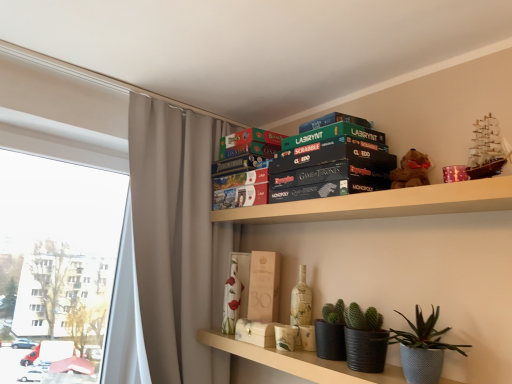
The width and height of the screenshot is (512, 384). What do you see at coordinates (236, 291) in the screenshot?
I see `white textured vase at center, the 1th paperback book in the left-to-right sequence` at bounding box center [236, 291].

Measure the distance between point (251, 307) and camera.

The distance of point (251, 307) from camera is 6.10 feet.

Find the location of a particular element. wooden board game boxes at upper center, placed as the 2th shelf when sorted from bottom to top is located at coordinates (382, 204).

The height and width of the screenshot is (384, 512). What do you see at coordinates (330, 163) in the screenshot? I see `black cardboard game box at upper center` at bounding box center [330, 163].

The height and width of the screenshot is (384, 512). In order to click on transparent glass window at left in this screenshot , I will do `click(59, 262)`.

What are the coordinates of `matte black pots at lower center, the first shelf ordered from the bottom` in the screenshot? It's located at (298, 362).

Looking at this image, is black cardboard game box at upper center not close to gray fabric curtain at upper left?

black cardboard game box at upper center is near gray fabric curtain at upper left, not far away.

In the scene shown: Is black cardboard game box at upper center facing towards gray fabric curtain at upper left?

No, black cardboard game box at upper center is not turned towards gray fabric curtain at upper left.

Between black cardboard game box at upper center and gray fabric curtain at upper left, which one has less height?

Standing shorter between the two is black cardboard game box at upper center.

Is point (335, 127) closer or farther from the camera than point (155, 322)?

Clearly, point (335, 127) is closer to the camera than point (155, 322).

Considering the relative sizes of matte black pots at lower center, which appears as the 2th shelf when viewed from the top, and brown plush bear at upper right in the image provided, is matte black pots at lower center, which appears as the 2th shelf when viewed from the top, shorter than brown plush bear at upper right?

Indeed, matte black pots at lower center, which appears as the 2th shelf when viewed from the top, has a lesser height compared to brown plush bear at upper right.

Between point (442, 380) and point (396, 179), which one is positioned in front?

Positioned in front is point (442, 380).

How different are the orientations of matte black pots at lower center, the first shelf ordered from the bottom, and brown plush bear at upper right in degrees?

The angular difference between matte black pots at lower center, the first shelf ordered from the bottom, and brown plush bear at upper right is 3.18 degrees.

Does matte black pots at lower center, the first shelf ordered from the bottom, have a larger size compared to brown plush bear at upper right?

Yes, matte black pots at lower center, the first shelf ordered from the bottom, is bigger than brown plush bear at upper right.

This screenshot has width=512, height=384. I want to click on houseplant lying on the right of black cardboard game box at upper center, so [x=423, y=348].

Is black cardboard game box at upper center situated inside textured gray pot at lower right or outside?

black cardboard game box at upper center is not enclosed by textured gray pot at lower right.

Consider the image. Which object is thinner, black cardboard game box at upper center or textured gray pot at lower right?

textured gray pot at lower right.

Is black cardboard game box at upper center oriented away from textured gray pot at lower right?

black cardboard game box at upper center is not turned away from textured gray pot at lower right.

Which point is more distant from viewer, (243, 303) or (156, 373)?

The point (243, 303) is farther from the camera.

From the picture: Who is shorter, white textured vase at center, positioned as the third paperback book in top-to-bottom order, or gray fabric curtain at upper left?

With less height is white textured vase at center, positioned as the third paperback book in top-to-bottom order.

Considering the sizes of objects white textured vase at center, the 1th paperback book when ordered from bottom to top, and gray fabric curtain at upper left in the image provided, who is bigger, white textured vase at center, the 1th paperback book when ordered from bottom to top, or gray fabric curtain at upper left?

gray fabric curtain at upper left is bigger.

Is wooden board game boxes at upper center, the first shelf from the top, oriented away from black cardboard game box at upper center?

No, wooden board game boxes at upper center, the first shelf from the top,'s orientation is not away from black cardboard game box at upper center.

Considering the sizes of objects wooden board game boxes at upper center, placed as the 2th shelf when sorted from bottom to top, and black cardboard game box at upper center in the image provided, who is smaller, wooden board game boxes at upper center, placed as the 2th shelf when sorted from bottom to top, or black cardboard game box at upper center?

wooden board game boxes at upper center, placed as the 2th shelf when sorted from bottom to top.

Between wooden board game boxes at upper center, placed as the 2th shelf when sorted from bottom to top, and black cardboard game box at upper center, which one has more height?

With more height is black cardboard game box at upper center.

Which is correct: wooden board game boxes at upper center, the first shelf from the top, is inside black cardboard game box at upper center, or outside of it?

wooden board game boxes at upper center, the first shelf from the top, is not enclosed by black cardboard game box at upper center.

At what (x,y) coordinates should I click in order to perform the action: click on book on the right of the gold textured vase at center. Please return your answer as a coordinate pair (x, y). The image size is (512, 384). Looking at the image, I should click on (330, 163).

Is black cardboard game box at upper center aimed at gold textured vase at center?

No, black cardboard game box at upper center is not oriented towards gold textured vase at center.

Between point (381, 144) and point (293, 305), which one is positioned in front?

Point (381, 144)

Is black cardboard game box at upper center surrounding gold textured vase at center?

No, gold textured vase at center is located outside of black cardboard game box at upper center.

Is wooden box at center, which is the 2th paperback book in left-to-right order, positioned beyond the bounds of textured gray pot at lower right?

wooden box at center, which is the 2th paperback book in left-to-right order, is positioned outside textured gray pot at lower right.

Between point (250, 301) and point (395, 330), which one is positioned behind?

The point (250, 301) is farther.

From the picture: Can you tell me how much wooden box at center, the 2th paperback book in the right-to-left sequence, and textured gray pot at lower right differ in facing direction?

They differ by 38 degrees in their facing directions.

In the image, there is a black cardboard game box at upper center. At what (x,y) coordinates should I click in order to perform the action: click on curtain below it (from the image's perspective). Please return your answer as a coordinate pair (x, y). The height and width of the screenshot is (384, 512). Looking at the image, I should click on click(177, 240).

Where is `toy that appears on the right of matte black pots at lower center, the first shelf ordered from the bottom`? Image resolution: width=512 pixels, height=384 pixels. toy that appears on the right of matte black pots at lower center, the first shelf ordered from the bottom is located at coordinates (411, 170).

Looking at the image, which one is located further to textured gray pot at lower right, gray fabric curtain at upper left or brown plush bear at upper right?

Among the two, gray fabric curtain at upper left is located further to textured gray pot at lower right.

Looking at the image, which one is located closer to wooden board game boxes at upper center, placed as the 2th shelf when sorted from bottom to top, wooden box at center, the 2th paperback book ordered from the bottom, or white textured vase at center, positioned as the third paperback book in top-to-bottom order?

Among the two, wooden box at center, the 2th paperback book ordered from the bottom, is located nearer to wooden board game boxes at upper center, placed as the 2th shelf when sorted from bottom to top.

Based on their spatial positions, is wooden board game boxes at upper center, placed as the 2th shelf when sorted from bottom to top, or matte black pots at lower center, which appears as the 2th shelf when viewed from the top, further from textured gray pot at lower right?

Based on the image, wooden board game boxes at upper center, placed as the 2th shelf when sorted from bottom to top, appears to be further to textured gray pot at lower right.

Estimate the real-world distances between objects in this image. Which object is further from brown plush bear at upper right, transparent glass window at left or black cardboard game box at upper center?

Based on the image, transparent glass window at left appears to be further to brown plush bear at upper right.

When comparing their distances from wooden board game boxes at upper center, the first shelf from the top, does matte black pots at lower center, which appears as the 2th shelf when viewed from the top, or gold textured vase at center seem closer?

gold textured vase at center lies closer to wooden board game boxes at upper center, the first shelf from the top, than the other object.

Based on their spatial positions, is gold textured vase at center or white textured vase at center, the 1th paperback book in the left-to-right sequence, closer to black cardboard game box at upper center?

Among the two, gold textured vase at center is located nearer to black cardboard game box at upper center.

From the image, which object appears to be nearer to gray fabric curtain at upper left, black cardboard game box at upper center or green matte board game at upper center, positioned as the third paperback book in left-to-right order?

The object closer to gray fabric curtain at upper left is black cardboard game box at upper center.

Which object lies nearer to the anchor point transparent glass window at left, wooden box at center, marked as the second paperback book in a top-to-bottom arrangement, or matte black pots at lower center, which appears as the 2th shelf when viewed from the top?

wooden box at center, marked as the second paperback book in a top-to-bottom arrangement.

Where is `houseplant between wooden board game boxes at upper center, placed as the 2th shelf when sorted from bottom to top, and wooden box at center, which is the 2th paperback book in left-to-right order, from front to back`? houseplant between wooden board game boxes at upper center, placed as the 2th shelf when sorted from bottom to top, and wooden box at center, which is the 2th paperback book in left-to-right order, from front to back is located at coordinates (423, 348).

Locate an element on the screen. The height and width of the screenshot is (384, 512). curtain between transparent glass window at left and green matte board game at upper center, marked as the 1th paperback book in a top-to-bottom arrangement is located at coordinates (177, 240).

This screenshot has height=384, width=512. Identify the location of curtain situated between transparent glass window at left and wooden box at center, which is the 2th paperback book in left-to-right order, from left to right. (177, 240).

You are a GUI agent. You are given a task and a screenshot of the screen. Output one action in this format:
    pyautogui.click(x=<x>, y=<y>)
    Task: Click on the shelf between black cardboard game box at upper center and matte black pots at lower center, which appears as the 2th shelf when viewed from the top, from top to bottom
    The width and height of the screenshot is (512, 384).
    Given the screenshot: What is the action you would take?
    pyautogui.click(x=382, y=204)